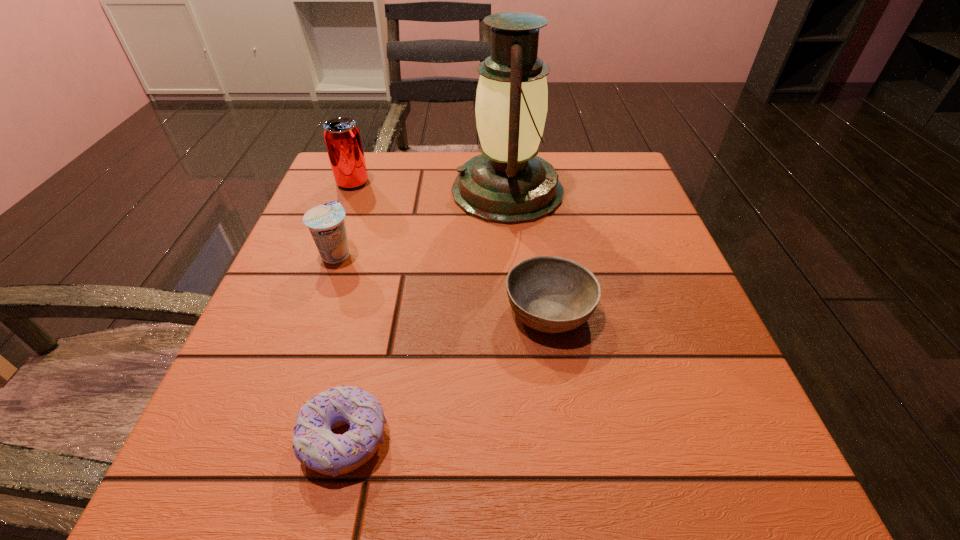
What are the coordinates of `vacant space located 0.310m on the right of the fourth shortest object` in the screenshot? It's located at (503, 183).

In order to click on free space located on the front of the third nearest object in this screenshot , I will do `click(252, 488)`.

This screenshot has height=540, width=960. Find the location of `vacant position located 0.180m on the front of the bowl`. vacant position located 0.180m on the front of the bowl is located at coordinates point(572,461).

The image size is (960, 540). I want to click on free space located on the back of the shortest object, so click(372, 318).

What are the coordinates of `lantern located at the far edge` in the screenshot? It's located at (508, 184).

The height and width of the screenshot is (540, 960). Find the location of `soda can that is at the far edge`. soda can that is at the far edge is located at coordinates (x=342, y=137).

The height and width of the screenshot is (540, 960). Identify the location of object at the near edge. (314, 444).

Where is `soda can situated at the left edge`? The image size is (960, 540). soda can situated at the left edge is located at coordinates (342, 137).

What are the coordinates of `yogurt at the left edge` in the screenshot? It's located at (326, 223).

In order to click on doughnut situated at the left edge in this screenshot , I will do `click(314, 444)`.